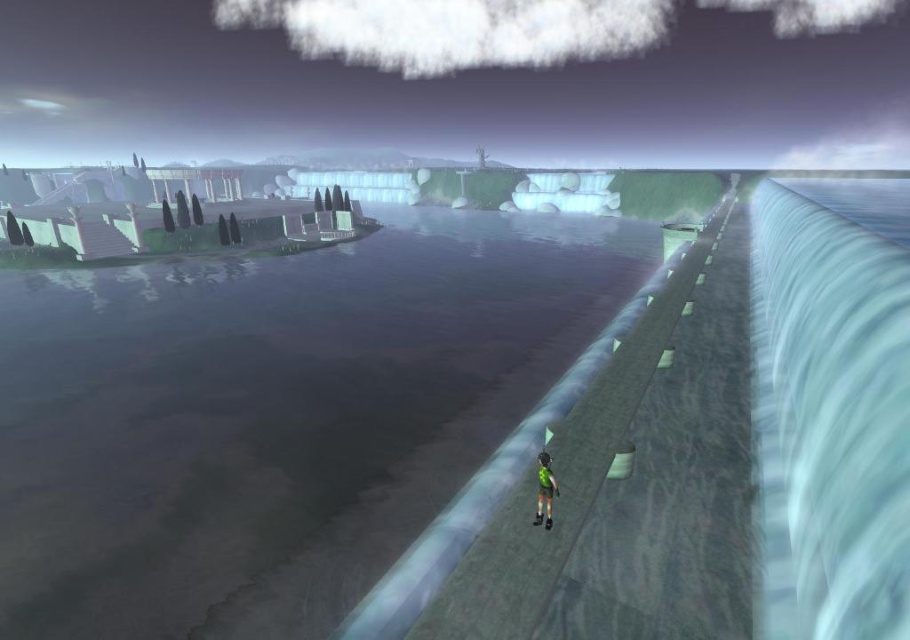
In the scene shown: How distant is smooth concrete water at center from green fabric shorts at center?

A distance of 54.99 feet exists between smooth concrete water at center and green fabric shorts at center.

What do you see at coordinates (273, 416) in the screenshot? Image resolution: width=910 pixels, height=640 pixels. I see `smooth concrete water at center` at bounding box center [273, 416].

What are the coordinates of `smooth concrete water at center` in the screenshot? It's located at (273, 416).